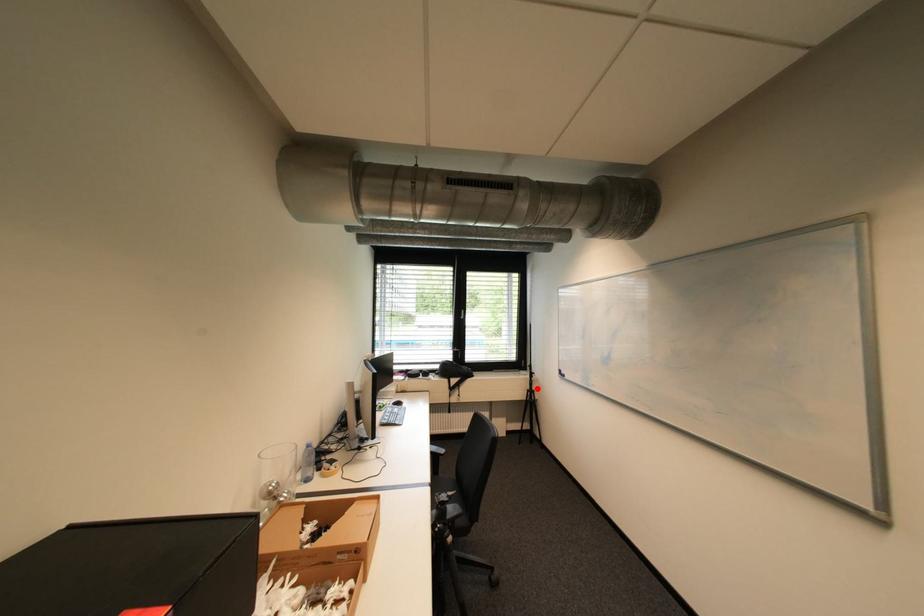
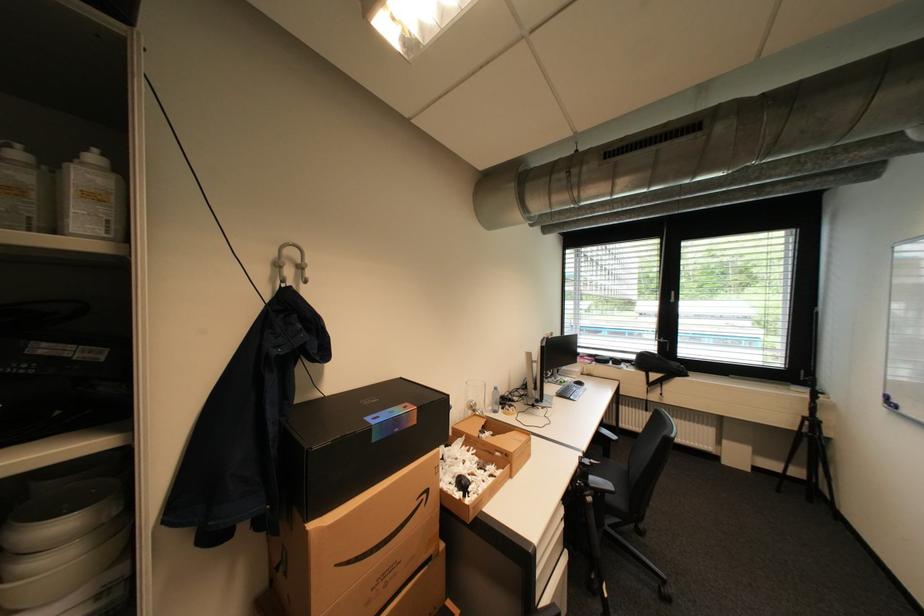
Question: I am providing you with two images of the same scene from different viewpoints. Given a red point in image1, look at the same physical point in image2. Is it:

Choices:
 (A) Closer to the viewpoint
 (B) Farther from the viewpoint

Answer: (A)